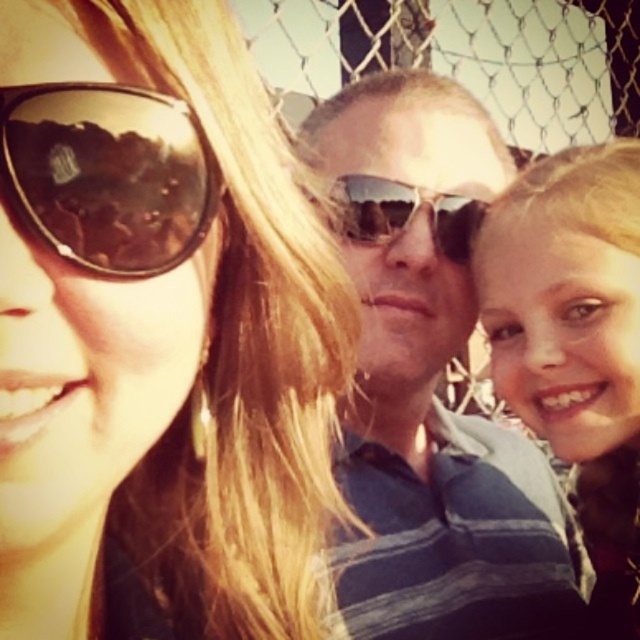
Question: Which point is farther to the camera?

Choices:
 (A) sunglasses at center
 (B) matte black sunglasses at upper left
 (C) blonde hair at center

Answer: (A)

Question: From the image, what is the correct spatial relationship of matte black sunglasses at upper left in relation to blonde hair at center?

Choices:
 (A) below
 (B) above

Answer: (A)

Question: Among these points, which one is farthest from the camera?

Choices:
 (A) (432, 476)
 (B) (84, 147)
 (C) (481, 200)

Answer: (A)

Question: Can you confirm if blonde hair at center is smaller than sunglasses at center?

Choices:
 (A) no
 (B) yes

Answer: (A)

Question: Among these points, which one is nearest to the camera?

Choices:
 (A) (451, 80)
 (B) (10, 115)
 (C) (112, 124)
 (D) (630, 566)

Answer: (B)

Question: Is blonde hair at center closer to camera compared to shiny brown sunglasses at upper left?

Choices:
 (A) yes
 (B) no

Answer: (B)